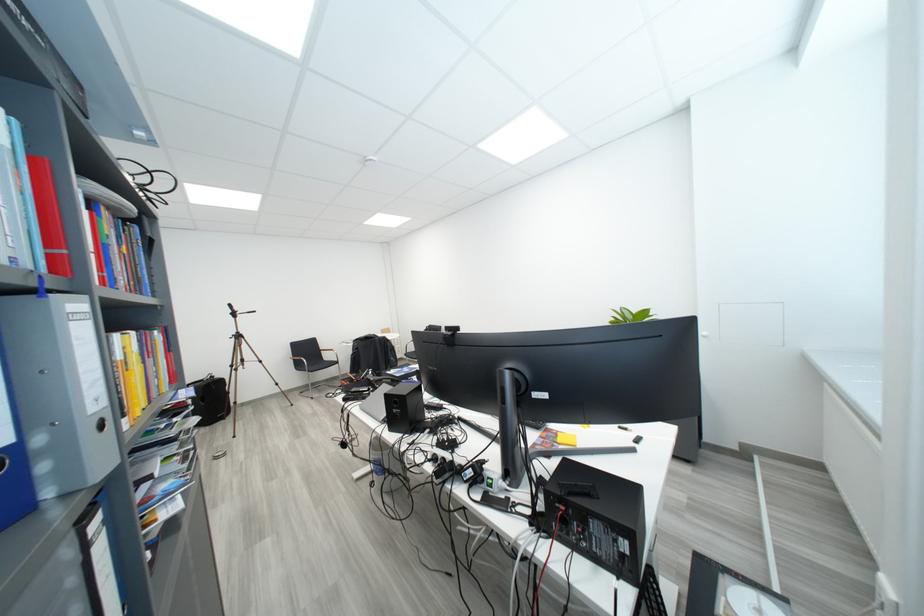
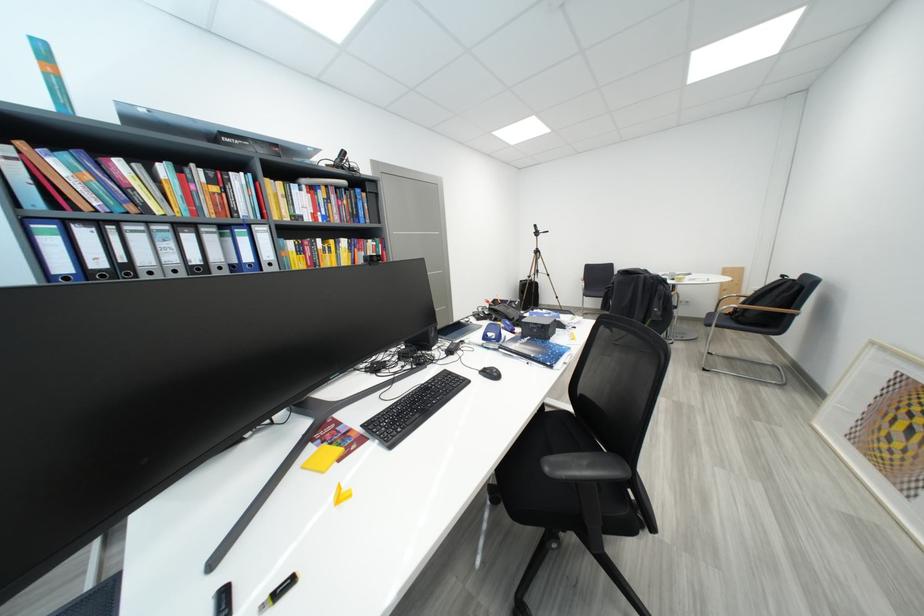
In the second image, find the point that corresponds to (550,448) in the first image.

(343, 432)